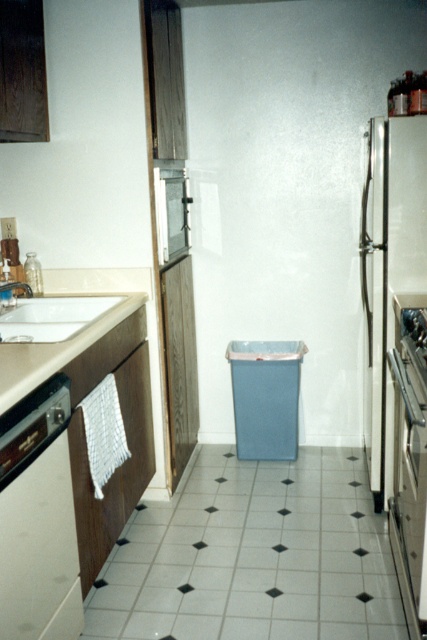
Question: Can you confirm if satin silver refrigerator at right is wider than brushed metal refrigerator at center?

Choices:
 (A) yes
 (B) no

Answer: (A)

Question: Which object is the closest to the white laminate counter at left?

Choices:
 (A) white glossy sink at left
 (B) satin silver refrigerator at right
 (C) white tile at center
 (D) brushed metal refrigerator at center

Answer: (A)

Question: Estimate the real-world distances between objects in this image. Which object is farther from the white tile at center?

Choices:
 (A) satin silver refrigerator at right
 (B) white glossy dishwasher at left
 (C) white laminate counter at left
 (D) brushed metal refrigerator at center

Answer: (D)

Question: From the image, what is the correct spatial relationship of white glossy dishwasher at left in relation to satin silver refrigerator at right?

Choices:
 (A) below
 (B) above

Answer: (A)

Question: Is white laminate counter at left to the left of brushed metal refrigerator at center from the viewer's perspective?

Choices:
 (A) yes
 (B) no

Answer: (A)

Question: Which point is closer to the camera taking this photo?

Choices:
 (A) (105, 326)
 (B) (164, 240)

Answer: (A)